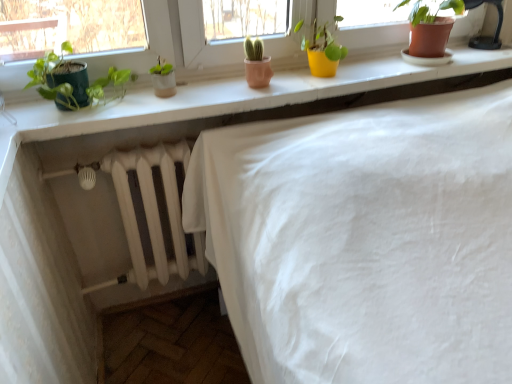
The height and width of the screenshot is (384, 512). What do you see at coordinates (323, 51) in the screenshot?
I see `yellow matte pot at upper center, which is counted as the 2th houseplant, starting from the left` at bounding box center [323, 51].

Where is `terracotta clay pot at upper right, arranged as the 3th houseplant when viewed from the left`? The image size is (512, 384). terracotta clay pot at upper right, arranged as the 3th houseplant when viewed from the left is located at coordinates (431, 29).

Locate an element on the screen. This screenshot has width=512, height=384. green matte pot at left, the 1th houseplant in the left-to-right sequence is located at coordinates (75, 82).

Where is `matte white windowsill at upper center`? This screenshot has height=384, width=512. matte white windowsill at upper center is located at coordinates (227, 99).

Find the location of a particular element. Image resolution: width=512 pixels, height=384 pixels. yellow matte pot at upper center, which is the second houseplant in right-to-left order is located at coordinates (323, 51).

Considering the sizes of objects yellow matte pot at upper center, which is the second houseplant in right-to-left order, and matte white windowsill at upper center in the image provided, who is bigger, yellow matte pot at upper center, which is the second houseplant in right-to-left order, or matte white windowsill at upper center?

matte white windowsill at upper center is bigger.

The width and height of the screenshot is (512, 384). I want to click on counter on the left side of yellow matte pot at upper center, which is counted as the 2th houseplant, starting from the left, so click(227, 99).

Are yellow matte pot at upper center, which is the second houseplant in right-to-left order, and matte white windowsill at upper center beside each other?

yellow matte pot at upper center, which is the second houseplant in right-to-left order, and matte white windowsill at upper center are not in contact.

Locate an element on the screen. houseplant on the left of the matte white windowsill at upper center is located at coordinates (75, 82).

Is green matte pot at left, the 1th houseplant in the left-to-right sequence, not close to matte white windowsill at upper center?

That's not correct — green matte pot at left, the 1th houseplant in the left-to-right sequence, is a little close to matte white windowsill at upper center.

From the image's perspective, is green matte pot at left, acting as the 3th houseplant starting from the right, located beneath matte white windowsill at upper center?

Yes, from the image's perspective, green matte pot at left, acting as the 3th houseplant starting from the right, is beneath matte white windowsill at upper center.

Consider the image. Which is correct: green matte pot at left, the 1th houseplant in the left-to-right sequence, is inside matte white windowsill at upper center, or outside of it?

green matte pot at left, the 1th houseplant in the left-to-right sequence, is not enclosed by matte white windowsill at upper center.

Could you tell me if terracotta clay pot at upper right, arranged as the 3th houseplant when viewed from the left, is facing yellow matte pot at upper center, which is counted as the 2th houseplant, starting from the left?

No.

Considering the relative sizes of terracotta clay pot at upper right, which is the first houseplant in right-to-left order, and yellow matte pot at upper center, which is the second houseplant in right-to-left order, in the image provided, is terracotta clay pot at upper right, which is the first houseplant in right-to-left order, thinner than yellow matte pot at upper center, which is the second houseplant in right-to-left order,?

No, terracotta clay pot at upper right, which is the first houseplant in right-to-left order, is not thinner than yellow matte pot at upper center, which is the second houseplant in right-to-left order.

Between terracotta clay pot at upper right, which is the first houseplant in right-to-left order, and yellow matte pot at upper center, which is counted as the 2th houseplant, starting from the left, which one is positioned behind?

terracotta clay pot at upper right, which is the first houseplant in right-to-left order.

Is yellow matte pot at upper center, which is the second houseplant in right-to-left order, far away from terracotta clay pot at upper right, arranged as the 3th houseplant when viewed from the left?

yellow matte pot at upper center, which is the second houseplant in right-to-left order, is near terracotta clay pot at upper right, arranged as the 3th houseplant when viewed from the left, not far away.

Is yellow matte pot at upper center, which is the second houseplant in right-to-left order, positioned with its back to terracotta clay pot at upper right, which is the first houseplant in right-to-left order?

No, terracotta clay pot at upper right, which is the first houseplant in right-to-left order, is not at the back of yellow matte pot at upper center, which is the second houseplant in right-to-left order.

Does point (344, 51) come farther from viewer compared to point (425, 34)?

That is True.

Does yellow matte pot at upper center, which is counted as the 2th houseplant, starting from the left, have a greater width compared to terracotta clay pot at upper right, which is the first houseplant in right-to-left order?

No.

From the image's perspective, is matte white windowsill at upper center above or below terracotta clay pot at upper right, which is the first houseplant in right-to-left order?

matte white windowsill at upper center is below terracotta clay pot at upper right, which is the first houseplant in right-to-left order.

Who is shorter, matte white windowsill at upper center or terracotta clay pot at upper right, arranged as the 3th houseplant when viewed from the left?

matte white windowsill at upper center.

From a real-world perspective, which object stands above the other?

From a 3D spatial view, terracotta clay pot at upper right, which is the first houseplant in right-to-left order, is above.

Is point (37, 106) closer or farther from the camera than point (430, 20)?

Clearly, point (37, 106) is closer to the camera than point (430, 20).

Does green matte pot at left, acting as the 3th houseplant starting from the right, contain yellow matte pot at upper center, which is counted as the 2th houseplant, starting from the left?

No, yellow matte pot at upper center, which is counted as the 2th houseplant, starting from the left, is located outside of green matte pot at left, acting as the 3th houseplant starting from the right.

Is green matte pot at left, acting as the 3th houseplant starting from the right, looking in the opposite direction of yellow matte pot at upper center, which is counted as the 2th houseplant, starting from the left?

No, yellow matte pot at upper center, which is counted as the 2th houseplant, starting from the left, is not at the back of green matte pot at left, acting as the 3th houseplant starting from the right.

Is green matte pot at left, the 1th houseplant in the left-to-right sequence, in front of or behind yellow matte pot at upper center, which is the second houseplant in right-to-left order, in the image?

In the image, green matte pot at left, the 1th houseplant in the left-to-right sequence, appears in front of yellow matte pot at upper center, which is the second houseplant in right-to-left order.

Choose the correct answer: Is terracotta clay pot at upper right, arranged as the 3th houseplant when viewed from the left, inside green matte pot at left, acting as the 3th houseplant starting from the right, or outside it?

terracotta clay pot at upper right, arranged as the 3th houseplant when viewed from the left, is spatially situated outside green matte pot at left, acting as the 3th houseplant starting from the right.

In terms of width, does terracotta clay pot at upper right, arranged as the 3th houseplant when viewed from the left, look wider or thinner when compared to green matte pot at left, the 1th houseplant in the left-to-right sequence?

Clearly, terracotta clay pot at upper right, arranged as the 3th houseplant when viewed from the left, has more width compared to green matte pot at left, the 1th houseplant in the left-to-right sequence.

At what (x,y) coordinates should I click in order to perform the action: click on houseplant located above the green matte pot at left, the 1th houseplant in the left-to-right sequence (from a real-world perspective). Please return your answer as a coordinate pair (x, y). Looking at the image, I should click on (431, 29).

Considering the positions of objects terracotta clay pot at upper right, which is the first houseplant in right-to-left order, and green matte pot at left, the 1th houseplant in the left-to-right sequence, in the image provided, who is more to the right, terracotta clay pot at upper right, which is the first houseplant in right-to-left order, or green matte pot at left, the 1th houseplant in the left-to-right sequence,?

terracotta clay pot at upper right, which is the first houseplant in right-to-left order, is more to the right.

Image resolution: width=512 pixels, height=384 pixels. I want to click on counter in front of the yellow matte pot at upper center, which is the second houseplant in right-to-left order, so click(227, 99).

Find the location of a particular element. The width and height of the screenshot is (512, 384). the 2nd houseplant directly above the matte white windowsill at upper center (from a real-world perspective) is located at coordinates (75, 82).

Looking at the image, which one is located further to terracotta clay pot at upper right, arranged as the 3th houseplant when viewed from the left, matte white windowsill at upper center or green matte pot at left, the 1th houseplant in the left-to-right sequence?

green matte pot at left, the 1th houseplant in the left-to-right sequence.

Considering their positions, is matte white windowsill at upper center positioned further to yellow matte pot at upper center, which is counted as the 2th houseplant, starting from the left, than terracotta clay pot at upper right, arranged as the 3th houseplant when viewed from the left?

Based on the image, terracotta clay pot at upper right, arranged as the 3th houseplant when viewed from the left, appears to be further to yellow matte pot at upper center, which is counted as the 2th houseplant, starting from the left.

Based on their spatial positions, is terracotta clay pot at upper right, which is the first houseplant in right-to-left order, or yellow matte pot at upper center, which is the second houseplant in right-to-left order, further from green matte pot at left, acting as the 3th houseplant starting from the right?

The object further to green matte pot at left, acting as the 3th houseplant starting from the right, is terracotta clay pot at upper right, which is the first houseplant in right-to-left order.

Considering their positions, is green matte pot at left, the 1th houseplant in the left-to-right sequence, positioned closer to yellow matte pot at upper center, which is counted as the 2th houseplant, starting from the left, than terracotta clay pot at upper right, which is the first houseplant in right-to-left order?

terracotta clay pot at upper right, which is the first houseplant in right-to-left order, lies closer to yellow matte pot at upper center, which is counted as the 2th houseplant, starting from the left, than the other object.

Looking at the image, which one is located further to terracotta clay pot at upper right, arranged as the 3th houseplant when viewed from the left, yellow matte pot at upper center, which is the second houseplant in right-to-left order, or matte white windowsill at upper center?

matte white windowsill at upper center is positioned further to the anchor terracotta clay pot at upper right, arranged as the 3th houseplant when viewed from the left.

Which object lies nearer to the anchor point yellow matte pot at upper center, which is counted as the 2th houseplant, starting from the left, green matte pot at left, the 1th houseplant in the left-to-right sequence, or matte white windowsill at upper center?

Based on the image, matte white windowsill at upper center appears to be nearer to yellow matte pot at upper center, which is counted as the 2th houseplant, starting from the left.

Considering their positions, is terracotta clay pot at upper right, which is the first houseplant in right-to-left order, positioned further to yellow matte pot at upper center, which is counted as the 2th houseplant, starting from the left, than green matte pot at left, the 1th houseplant in the left-to-right sequence?

green matte pot at left, the 1th houseplant in the left-to-right sequence, is positioned further to the anchor yellow matte pot at upper center, which is counted as the 2th houseplant, starting from the left.

Which object lies nearer to the anchor point matte white windowsill at upper center, terracotta clay pot at upper right, arranged as the 3th houseplant when viewed from the left, or yellow matte pot at upper center, which is counted as the 2th houseplant, starting from the left?

The object closer to matte white windowsill at upper center is yellow matte pot at upper center, which is counted as the 2th houseplant, starting from the left.

Where is `houseplant between green matte pot at left, acting as the 3th houseplant starting from the right, and terracotta clay pot at upper right, which is the first houseplant in right-to-left order`? Image resolution: width=512 pixels, height=384 pixels. houseplant between green matte pot at left, acting as the 3th houseplant starting from the right, and terracotta clay pot at upper right, which is the first houseplant in right-to-left order is located at coordinates (323, 51).

Where is `counter situated between green matte pot at left, the 1th houseplant in the left-to-right sequence, and yellow matte pot at upper center, which is the second houseplant in right-to-left order, from left to right`? This screenshot has width=512, height=384. counter situated between green matte pot at left, the 1th houseplant in the left-to-right sequence, and yellow matte pot at upper center, which is the second houseplant in right-to-left order, from left to right is located at coordinates (227, 99).

Find the location of a particular element. houseplant located between matte white windowsill at upper center and terracotta clay pot at upper right, arranged as the 3th houseplant when viewed from the left, in the left-right direction is located at coordinates (323, 51).

You are a GUI agent. You are given a task and a screenshot of the screen. Output one action in this format:
    pyautogui.click(x=<x>, y=<y>)
    Task: Click on the counter between green matte pot at left, the 1th houseplant in the left-to-right sequence, and terracotta clay pot at upper right, arranged as the 3th houseplant when viewed from the left, in the horizontal direction
    
    Given the screenshot: What is the action you would take?
    pyautogui.click(x=227, y=99)